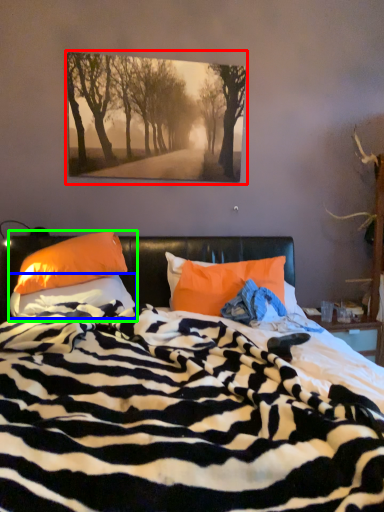
Question: Considering the real-world distances, which object is farthest from picture frame (highlighted by a red box)? pillow (highlighted by a blue box) or pillow (highlighted by a green box)?

Choices:
 (A) pillow
 (B) pillow

Answer: (A)